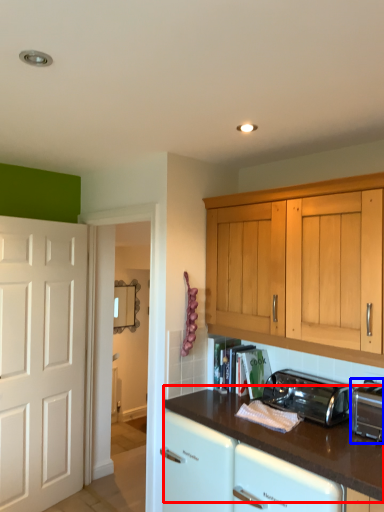
Question: Which object appears farthest to the camera in this image, countertop (highlighted by a red box) or toaster (highlighted by a blue box)?

Choices:
 (A) countertop
 (B) toaster

Answer: (B)